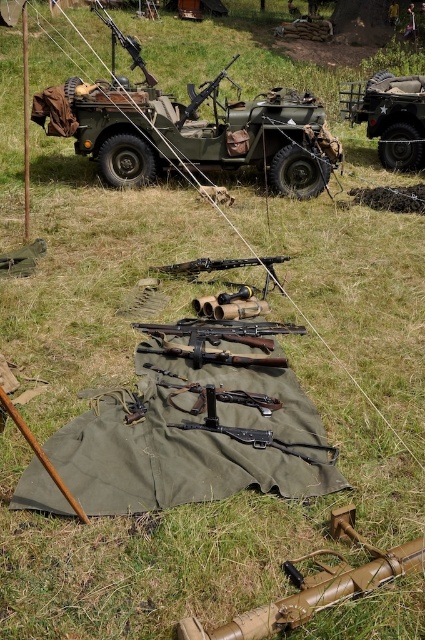
You are a photographer positioned at the camera location. You want to take a photo focusing on the two points marked in the image. Which point, point 1 at coordinates (x=175, y=113) or point 2 at coordinates (x=101, y=3), will appear larger in the photo?

Point 1 at coordinates (x=175, y=113) will appear larger in the photo because it is closer to the camera than point 2 at coordinates (x=101, y=3).

You are a military historian examining the setup. You notice a point marked at coordinates (189, 128). Which object in the scene does this point belong to?

The point at coordinates (189, 128) is on the green matte military vehicle at center.